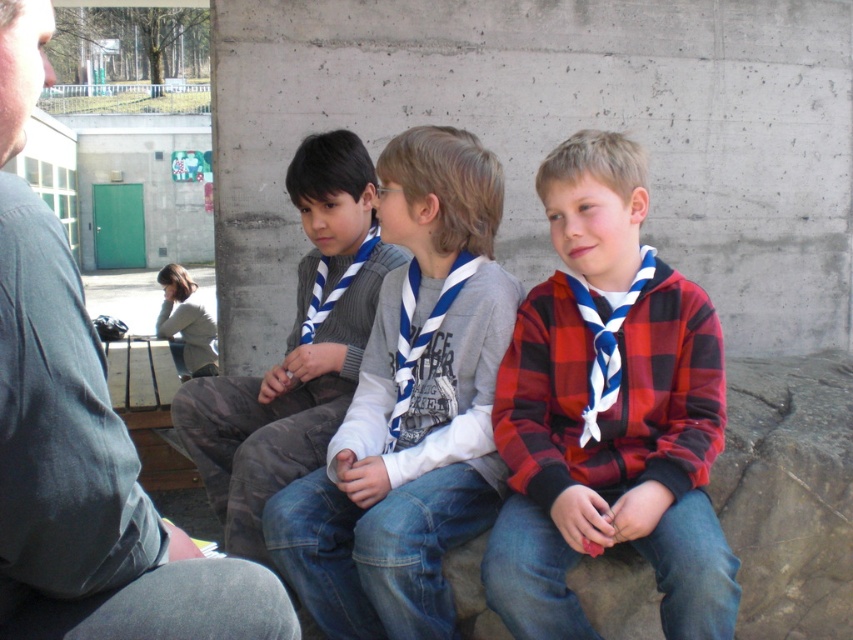
You are trying to decide which clothing item to wear for a cold day. You have the gray cotton shirt at left and the gray sweater vest at center. Based on the image, which one would provide better insulation?

The gray sweater vest at center is thicker than the gray cotton shirt at left, so it would provide better insulation.

You are a photographer trying to capture a candid shot of the two boys. You notice the blue and white striped scarf at center and the gray cotton shirt at left. Which object should you focus on first if you want to capture the lower part of the scene?

The blue and white striped scarf at center is below the gray cotton shirt at left, so you should focus on the blue and white striped scarf at center first to capture the lower part of the scene.